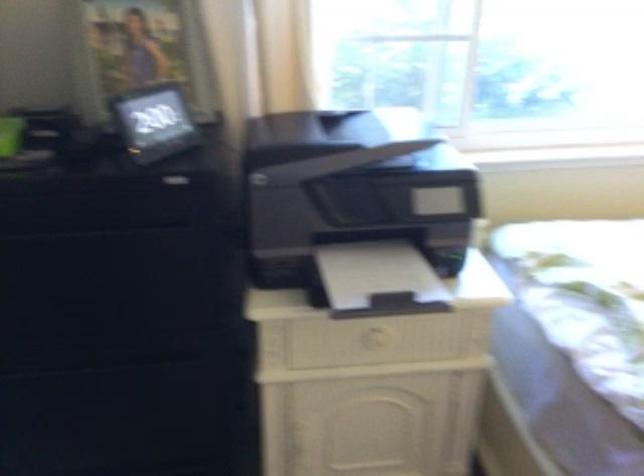
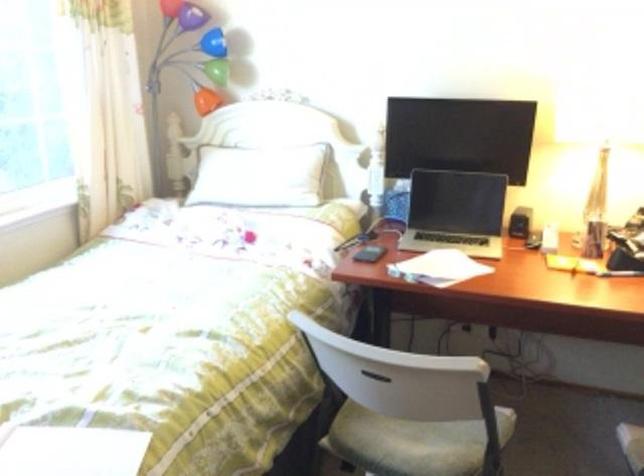
Question: Based on the continuous images, in which direction is the camera rotating? Reply with the corresponding letter.

Choices:
 (A) Left
 (B) Right
 (C) Up
 (D) Down

Answer: (B)